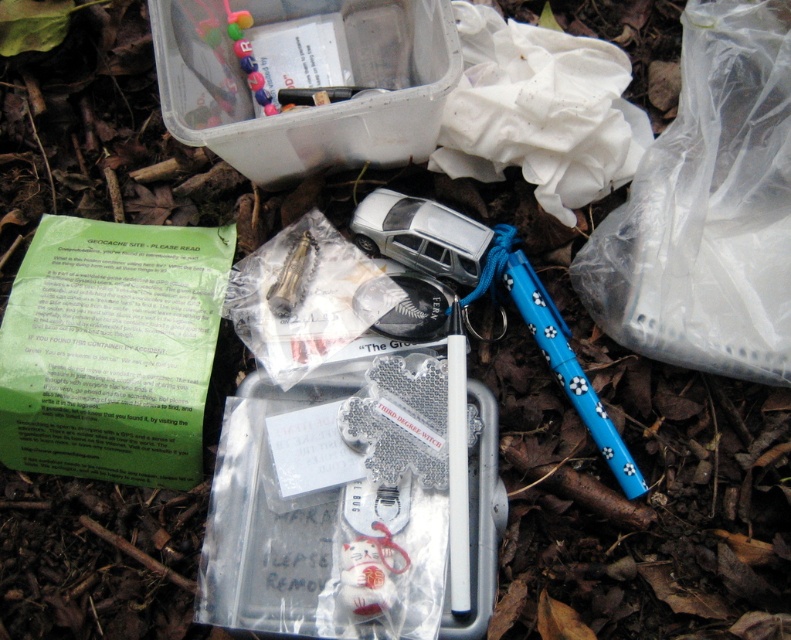
You are a geocacher who found the container and logbook. You need to sign the logbook with the pen. Can you reach the blue plastic pen at lower right without moving the porcelain white cat at center?

The blue plastic pen at lower right is above the porcelain white cat at center, so you can reach the blue plastic pen at lower right without moving the porcelain white cat at center because it is positioned higher.

You are a geocacher trying to locate a hidden treasure. You have two coordinates marked on your map as point A at position (615, 321) and point B at position (392, 566). According to the image, which point is closer to the geocaching container located at the top left corner?

Point A at position (615, 321) is closer to the geocaching container located at the top left corner because it is behind point B at position (392, 566), meaning it is nearer to the container.

You are a geocacher who found a blue plastic pen at lower right and a porcelain white cat at center. You want to know if the pen can fit into a small compartment of your backpack that can only hold items narrower than the cat. Can it?

The blue plastic pen at lower right is wider than the porcelain white cat at center, so it cannot fit into the compartment since it is wider than the cat.